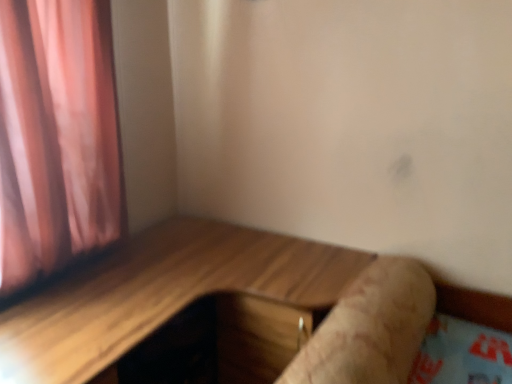
Question: Considering the positions of wooden table at center and brown textured log at lower right in the image, is wooden table at center taller or shorter than brown textured log at lower right?

Choices:
 (A) tall
 (B) short

Answer: (A)

Question: Looking at the image, does wooden table at center seem bigger or smaller compared to brown textured log at lower right?

Choices:
 (A) small
 (B) big

Answer: (B)

Question: Is wooden table at center situated inside brown textured log at lower right or outside?

Choices:
 (A) inside
 (B) outside

Answer: (B)

Question: Is brown textured log at lower right inside or outside of wooden table at center?

Choices:
 (A) outside
 (B) inside

Answer: (A)

Question: From the image's perspective, is brown textured log at lower right located above or below wooden table at center?

Choices:
 (A) above
 (B) below

Answer: (A)

Question: From a real-world perspective, is brown textured log at lower right positioned above or below wooden table at center?

Choices:
 (A) above
 (B) below

Answer: (A)

Question: Based on their sizes in the image, would you say brown textured log at lower right is bigger or smaller than wooden table at center?

Choices:
 (A) big
 (B) small

Answer: (B)